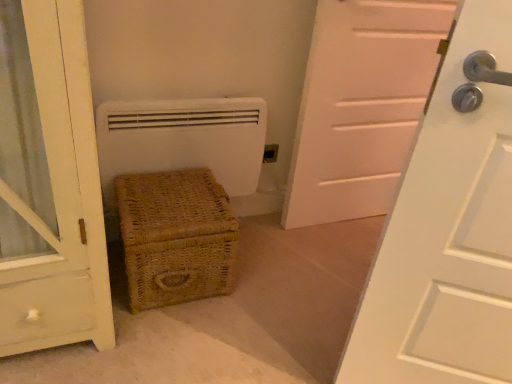
The width and height of the screenshot is (512, 384). I want to click on vacant region to the right of woven brown basket at lower left, so click(x=269, y=282).